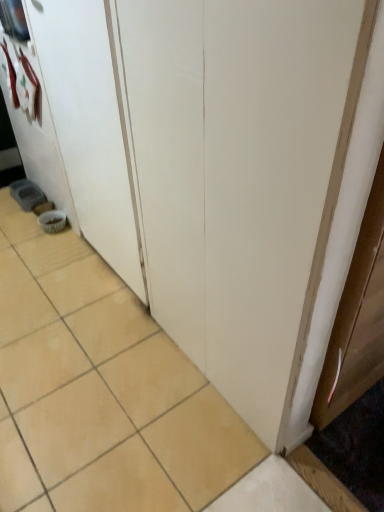
What do you see at coordinates (100, 389) in the screenshot? This screenshot has height=512, width=384. I see `beige ceramic tile at lower left` at bounding box center [100, 389].

In order to face beige ceramic tile at lower left, should I rotate leftwards or rightwards?

Rotate your view left by about 19.244°.

Identify the location of beige ceramic tile at lower left. The width and height of the screenshot is (384, 512). (100, 389).

In order to click on white matte door at lower left in this screenshot , I will do `click(91, 127)`.

Measure the distance between point (134, 224) and camera.

1.44 meters.

What is the approximate height of white matte door at lower left?

white matte door at lower left is 3.56 feet tall.

Describe the element at coordinates (91, 127) in the screenshot. This screenshot has height=512, width=384. I see `white matte door at lower left` at that location.

Measure the distance between white matte door at lower left and camera.

3.34 feet.

Identify the location of beige ceramic tile at lower left. This screenshot has height=512, width=384. (100, 389).

Visually, is white matte door at lower left positioned to the left or to the right of beige ceramic tile at lower left?

white matte door at lower left is to the right of beige ceramic tile at lower left.

Is white matte door at lower left closer to camera compared to beige ceramic tile at lower left?

No, white matte door at lower left is further to the viewer.

Which is closer, (x=126, y=142) or (x=30, y=244)?

The point (x=126, y=142) is more forward.

From the image's perspective, between white matte door at lower left and beige ceramic tile at lower left, which one is located above?

white matte door at lower left appears higher in the image.

From a real-world perspective, which object rests below the other?

In real-world perspective, beige ceramic tile at lower left is lower.

Between white matte door at lower left and beige ceramic tile at lower left, which one has smaller width?

With smaller width is white matte door at lower left.

Consider the image. From their relative heights in the image, would you say white matte door at lower left is taller or shorter than beige ceramic tile at lower left?

white matte door at lower left is taller than beige ceramic tile at lower left.

Looking at the image, does white matte door at lower left seem bigger or smaller compared to beige ceramic tile at lower left?

Clearly, white matte door at lower left is smaller in size than beige ceramic tile at lower left.

Is white matte door at lower left inside the boundaries of beige ceramic tile at lower left, or outside?

white matte door at lower left cannot be found inside beige ceramic tile at lower left.

Are white matte door at lower left and beige ceramic tile at lower left making contact?

No, white matte door at lower left is not next to beige ceramic tile at lower left.

Is white matte door at lower left aimed at beige ceramic tile at lower left?

Yes, white matte door at lower left is turned towards beige ceramic tile at lower left.

Where is `ceramic tile below the white matte door at lower left (from a real-world perspective)`? The image size is (384, 512). ceramic tile below the white matte door at lower left (from a real-world perspective) is located at coordinates (100, 389).

Is beige ceramic tile at lower left to the left or to the right of white matte door at lower left in the image?

In the image, beige ceramic tile at lower left appears on the left side of white matte door at lower left.

Considering the relative positions of beige ceramic tile at lower left and white matte door at lower left in the image provided, is beige ceramic tile at lower left behind white matte door at lower left?

No, beige ceramic tile at lower left is closer to the viewer.

Considering the positions of point (62, 499) and point (109, 183), is point (62, 499) closer or farther from the camera than point (109, 183)?

Point (62, 499) is positioned closer to the camera compared to point (109, 183).

Looking at this image, from the image's perspective, is beige ceramic tile at lower left positioned above or below white matte door at lower left?

Clearly, from the image's perspective, beige ceramic tile at lower left is below white matte door at lower left.

From a real-world perspective, who is located lower, beige ceramic tile at lower left or white matte door at lower left?

In real-world perspective, beige ceramic tile at lower left is lower.

Between beige ceramic tile at lower left and white matte door at lower left, which one has smaller width?

Thinner between the two is white matte door at lower left.

Is beige ceramic tile at lower left shorter than white matte door at lower left?

Indeed, beige ceramic tile at lower left has a lesser height compared to white matte door at lower left.

Who is bigger, beige ceramic tile at lower left or white matte door at lower left?

beige ceramic tile at lower left.

Is white matte door at lower left a part of beige ceramic tile at lower left?

No, white matte door at lower left is not surrounded by beige ceramic tile at lower left.

Looking at this image, is beige ceramic tile at lower left placed right next to white matte door at lower left?

beige ceramic tile at lower left and white matte door at lower left are clearly separated.

Could you tell me if beige ceramic tile at lower left is turned towards white matte door at lower left?

No, beige ceramic tile at lower left is not turned towards white matte door at lower left.

From the picture: How different are the orientations of beige ceramic tile at lower left and white matte door at lower left in degrees?

90.7 degrees.

At what (x,y) coordinates should I click in order to perform the action: click on screen door that is above the beige ceramic tile at lower left (from a real-world perspective). Please return your answer as a coordinate pair (x, y). Looking at the image, I should click on (91, 127).

Locate an element on the screen. ceramic tile located below the white matte door at lower left (from the image's perspective) is located at coordinates (100, 389).

Where is `screen door that appears above the beige ceramic tile at lower left (from the image's perspective)`? The image size is (384, 512). screen door that appears above the beige ceramic tile at lower left (from the image's perspective) is located at coordinates (91, 127).